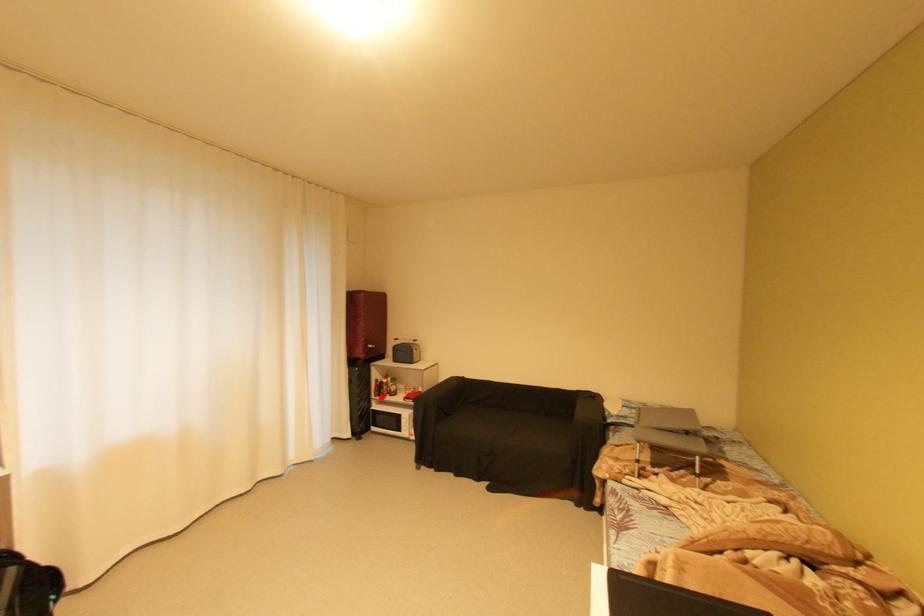
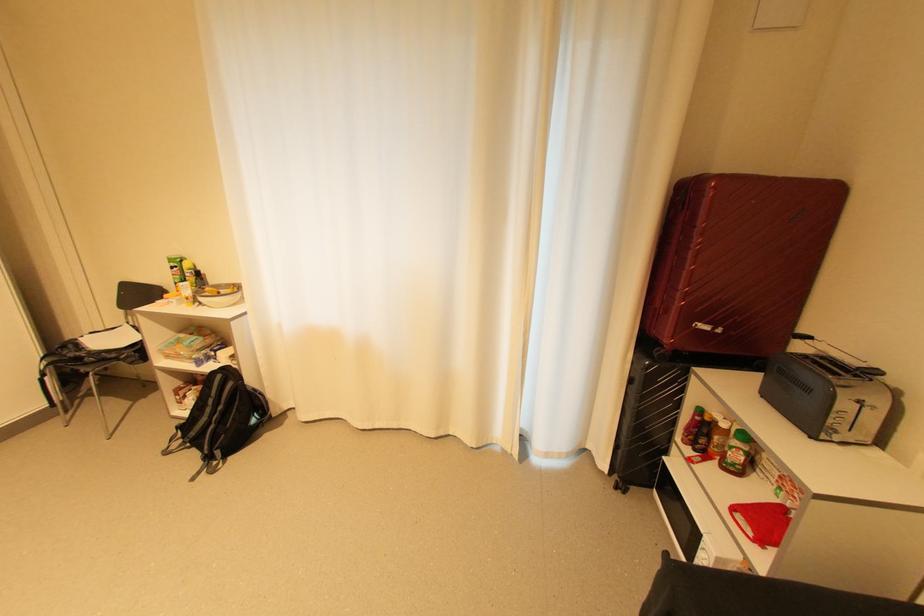
In the second image, find the point that corresponds to the highlighted location in the first image.

(686, 439)